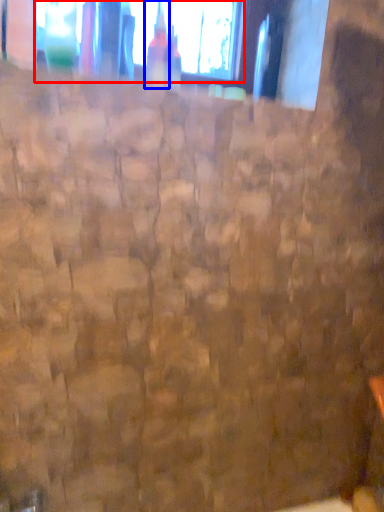
Question: Which object is closer to the camera taking this photo, window (highlighted by a red box) or bottle (highlighted by a blue box)?

Choices:
 (A) window
 (B) bottle

Answer: (B)